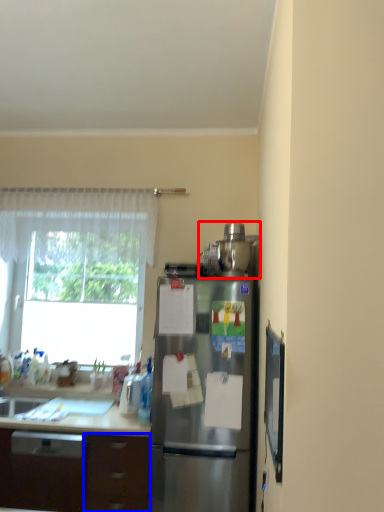
Question: Among these objects, which one is nearest to the camera, appliance (highlighted by a red box) or drawer (highlighted by a blue box)?

Choices:
 (A) appliance
 (B) drawer

Answer: (B)